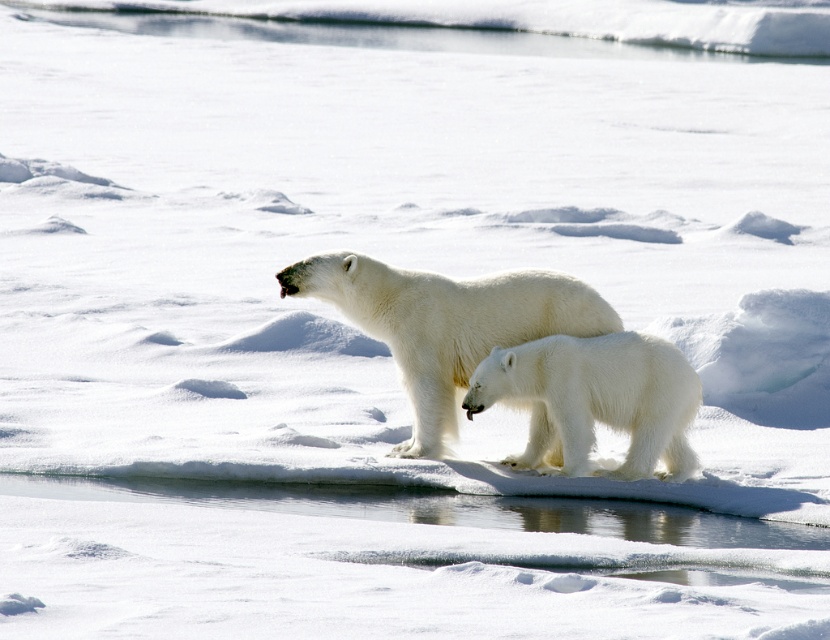
Question: In this image, where is white fur polar bear at center located relative to white fluffy polar bear at center?

Choices:
 (A) above
 (B) below

Answer: (A)

Question: Which point is closer to the camera taking this photo?

Choices:
 (A) (596, 314)
 (B) (582, 467)

Answer: (B)

Question: Can you confirm if white fur polar bear at center is wider than white fluffy polar bear at center?

Choices:
 (A) yes
 (B) no

Answer: (A)

Question: Among these objects, which one is nearest to the camera?

Choices:
 (A) white fluffy polar bear at center
 (B) white fur polar bear at center

Answer: (A)

Question: Is white fur polar bear at center below white fluffy polar bear at center?

Choices:
 (A) yes
 (B) no

Answer: (B)